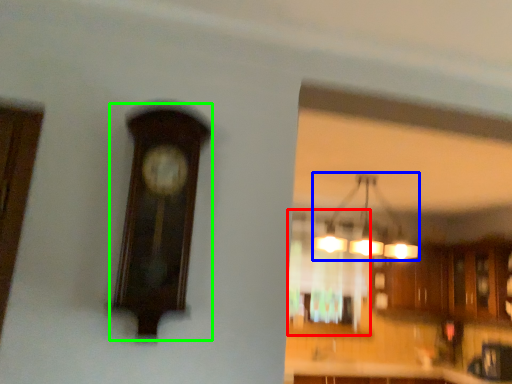
Question: Which object is positioned farthest from window (highlighted by a red box)? Select from lamp (highlighted by a blue box) and clock (highlighted by a green box).

Choices:
 (A) lamp
 (B) clock

Answer: (B)